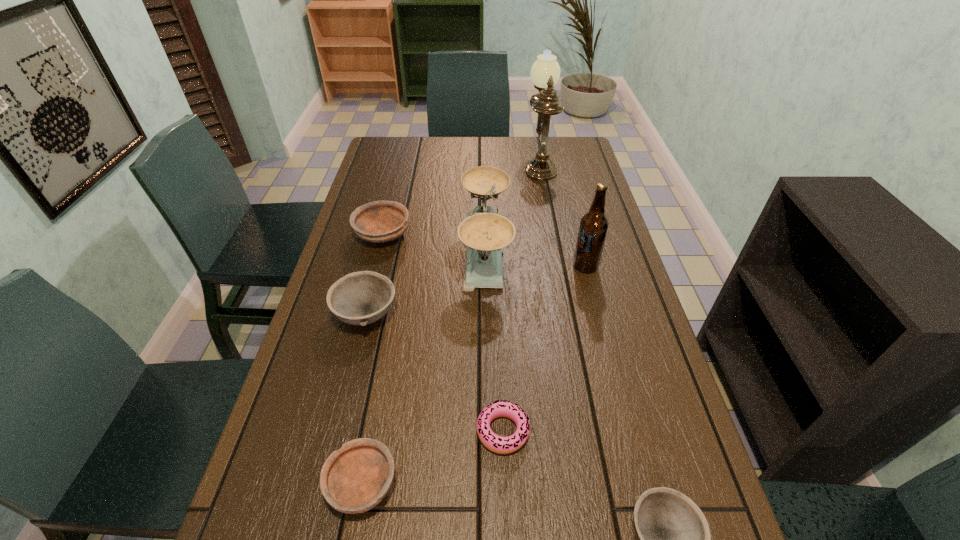
Locate an element on the screen. the farthest object is located at coordinates (545, 72).

You are a GUI agent. You are given a task and a screenshot of the screen. Output one action in this format:
    pyautogui.click(x=<x>, y=<y>)
    Task: Click on the oil lamp
    This screenshot has width=960, height=540.
    Given the screenshot: What is the action you would take?
    545,72

Locate an element on the screen. This screenshot has height=540, width=960. beer bottle is located at coordinates (594, 224).

Where is `scale`? Image resolution: width=960 pixels, height=540 pixels. scale is located at coordinates point(485,232).

The width and height of the screenshot is (960, 540). Identify the location of the third nearest bowl. (360, 298).

Find the location of `the left gray bowl`. the left gray bowl is located at coordinates (360, 298).

Find the location of a particular element. the farthest bowl is located at coordinates (380, 221).

This screenshot has width=960, height=540. In order to click on the bigger brown bowl in this screenshot , I will do `click(380, 221)`.

Locate an element on the screen. the second shortest object is located at coordinates (354, 479).

Find the location of a particular element. Image resolution: width=960 pixels, height=540 pixels. the shortest bowl is located at coordinates (354, 479).